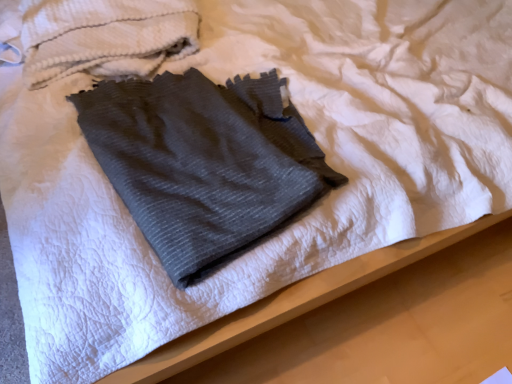
Question: Is gray ribbed towel at center, the second towel positioned from the top, taller or shorter than white textured towel at upper left, the 2th towel from the bottom?

Choices:
 (A) tall
 (B) short

Answer: (B)

Question: From a real-world perspective, relative to white textured towel at upper left, positioned as the 1th towel in top-to-bottom order, is gray ribbed towel at center, the second towel positioned from the top, vertically above or below?

Choices:
 (A) above
 (B) below

Answer: (B)

Question: Looking at their shapes, would you say gray ribbed towel at center, the second towel positioned from the top, is wider or thinner than white textured towel at upper left, positioned as the 1th towel in top-to-bottom order?

Choices:
 (A) wide
 (B) thin

Answer: (B)

Question: From the image's perspective, relative to gray ribbed towel at center, the first towel from the bottom, is white textured towel at upper left, the 2th towel from the bottom, above or below?

Choices:
 (A) below
 (B) above

Answer: (B)

Question: Do you think white textured towel at upper left, positioned as the 1th towel in top-to-bottom order, is within gray ribbed towel at center, the first towel from the bottom, or outside of it?

Choices:
 (A) inside
 (B) outside

Answer: (B)

Question: Considering the positions of white textured towel at upper left, positioned as the 1th towel in top-to-bottom order, and gray ribbed towel at center, the second towel positioned from the top, in the image, is white textured towel at upper left, positioned as the 1th towel in top-to-bottom order, wider or thinner than gray ribbed towel at center, the second towel positioned from the top,?

Choices:
 (A) wide
 (B) thin

Answer: (A)

Question: From a real-world perspective, is white textured towel at upper left, positioned as the 1th towel in top-to-bottom order, above or below gray ribbed towel at center, the second towel positioned from the top?

Choices:
 (A) above
 (B) below

Answer: (A)